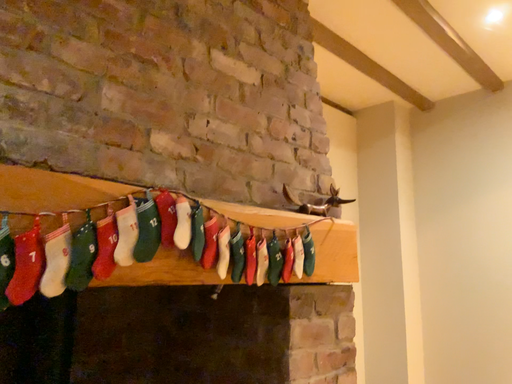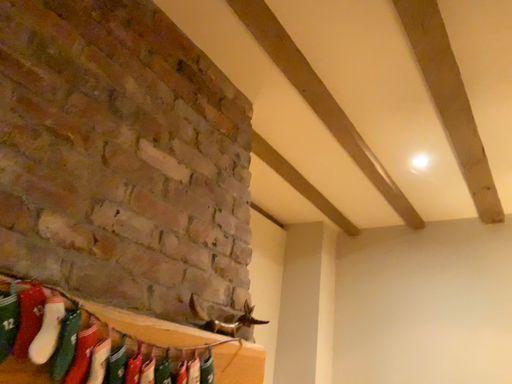
Question: Which way did the camera rotate in the video?

Choices:
 (A) rotated right
 (B) rotated left

Answer: (A)